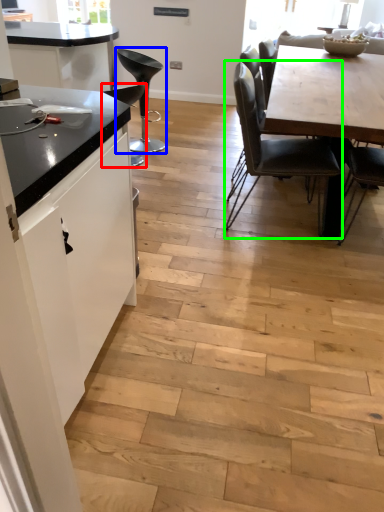
Question: Which object is positioned closest to chair (highlighted by a red box)? Select from chair (highlighted by a blue box) and chair (highlighted by a green box).

Choices:
 (A) chair
 (B) chair

Answer: (A)